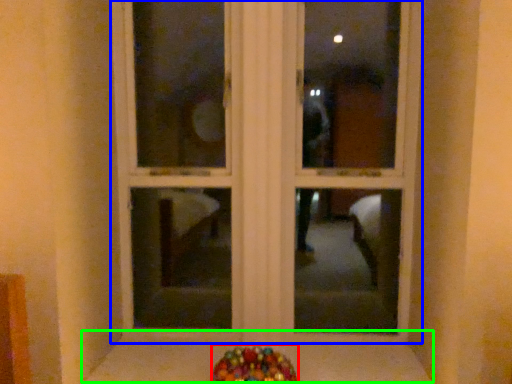
Question: Which object is positioned farthest from candy (highlighted by a red box)? Select from window frame (highlighted by a blue box) and window sill (highlighted by a green box).

Choices:
 (A) window frame
 (B) window sill

Answer: (A)